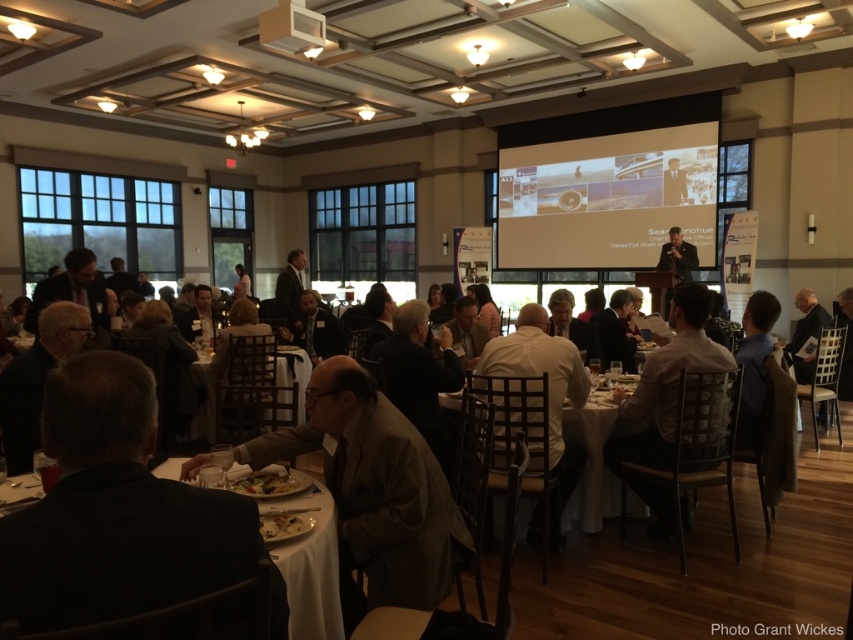
Question: Which point is farther to the camera?

Choices:
 (A) matte white projector screen at upper center
 (B) white cloth at lower left

Answer: (A)

Question: Does wooden chair at center appear over golden brown bread at lower center?

Choices:
 (A) yes
 (B) no

Answer: (A)

Question: From the image, what is the correct spatial relationship of white cloth at lower left in relation to white fabric table at center?

Choices:
 (A) right
 (B) left

Answer: (B)

Question: Observing the image, what is the correct spatial positioning of white shirt at center in reference to white cloth at lower left?

Choices:
 (A) above
 (B) below

Answer: (A)

Question: Which of the following is the farthest from the observer?

Choices:
 (A) white shirt at center
 (B) matte white projector screen at upper center
 (C) white fabric table at center
 (D) light brown leather jacket at center

Answer: (B)

Question: Which point is closer to the camera taking this photo?

Choices:
 (A) [x=279, y=522]
 (B) [x=204, y=413]
 (C) [x=363, y=545]
 (D) [x=660, y=413]

Answer: (A)